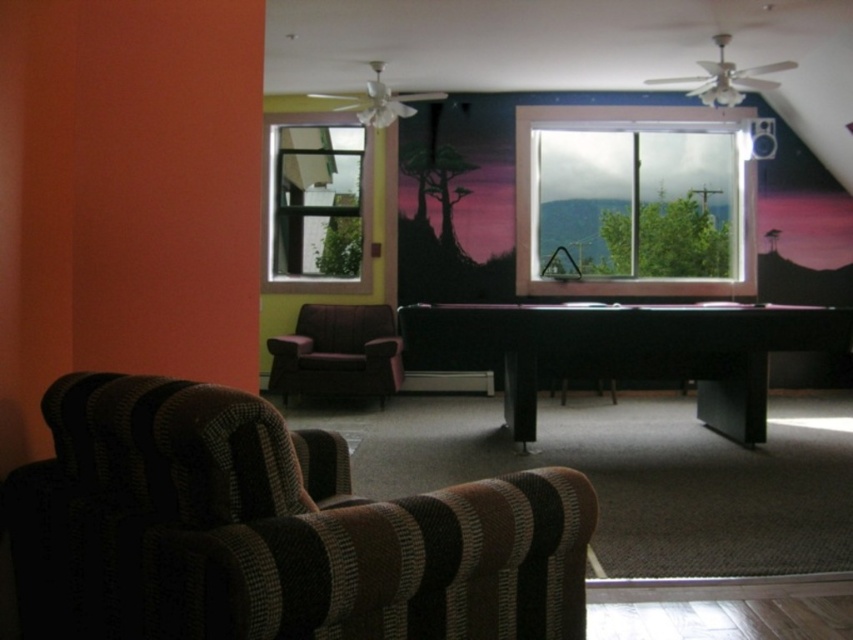
Question: Which point is farther to the camera?

Choices:
 (A) (537, 385)
 (B) (624, 125)

Answer: (B)

Question: Which point is closer to the camera?

Choices:
 (A) [x=271, y=385]
 (B) [x=316, y=209]

Answer: (A)

Question: Can you confirm if striped fabric couch at lower left is positioned to the right of dark brown leather armchair at center?

Choices:
 (A) no
 (B) yes

Answer: (A)

Question: Does striped fabric couch at lower left have a lesser width compared to matte purple armchair at center?

Choices:
 (A) yes
 (B) no

Answer: (B)

Question: Estimate the real-world distances between objects in this image. Which object is farther from the matte purple armchair at center?

Choices:
 (A) dark brown leather armchair at center
 (B) striped fabric couch at lower left

Answer: (B)

Question: Is clear glass window at upper left closer to the viewer compared to clear glass window at center?

Choices:
 (A) yes
 (B) no

Answer: (B)